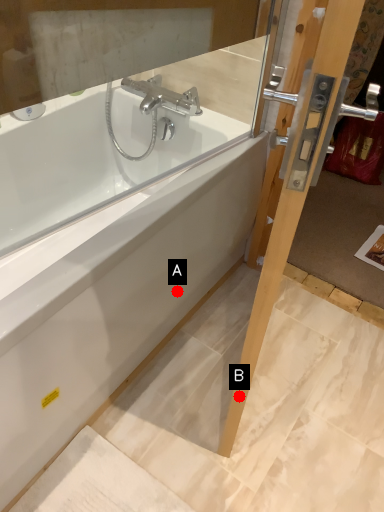
Question: Two points are circled on the image, labeled by A and B beside each circle. Which of the following is the farthest from the observer?

Choices:
 (A) A is further
 (B) B is further

Answer: (A)